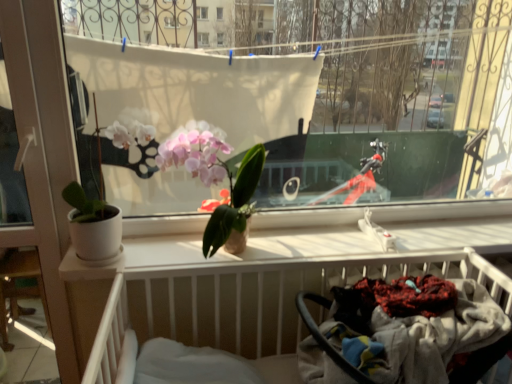
Question: Considering the relative sizes of white plastic screen door at left and pink matte orchid at center in the image provided, is white plastic screen door at left wider than pink matte orchid at center?

Choices:
 (A) no
 (B) yes

Answer: (A)

Question: Is white plastic screen door at left oriented towards pink matte orchid at center?

Choices:
 (A) yes
 (B) no

Answer: (B)

Question: Does white plastic screen door at left have a lesser width compared to pink matte orchid at center?

Choices:
 (A) no
 (B) yes

Answer: (B)

Question: Is white plastic screen door at left at the left side of pink matte orchid at center?

Choices:
 (A) yes
 (B) no

Answer: (A)

Question: From the image's perspective, is white plastic screen door at left below pink matte orchid at center?

Choices:
 (A) yes
 (B) no

Answer: (A)

Question: Is pink matte orchid at center wider or thinner than black rubber baby carriage at lower right?

Choices:
 (A) thin
 (B) wide

Answer: (A)

Question: From the image's perspective, is pink matte orchid at center above or below black rubber baby carriage at lower right?

Choices:
 (A) above
 (B) below

Answer: (A)

Question: In terms of size, does pink matte orchid at center appear bigger or smaller than black rubber baby carriage at lower right?

Choices:
 (A) small
 (B) big

Answer: (A)

Question: Is pink matte orchid at center taller or shorter than black rubber baby carriage at lower right?

Choices:
 (A) tall
 (B) short

Answer: (A)

Question: Relative to white plastic hospital bed at lower center, is pink matte orchid at center in front or behind?

Choices:
 (A) behind
 (B) front

Answer: (A)

Question: Choose the correct answer: Is pink matte orchid at center inside white plastic hospital bed at lower center or outside it?

Choices:
 (A) outside
 (B) inside

Answer: (A)

Question: From the image's perspective, relative to white plastic hospital bed at lower center, is pink matte orchid at center above or below?

Choices:
 (A) below
 (B) above

Answer: (B)

Question: From their relative heights in the image, would you say pink matte orchid at center is taller or shorter than white plastic hospital bed at lower center?

Choices:
 (A) tall
 (B) short

Answer: (B)

Question: In terms of size, does black rubber baby carriage at lower right appear bigger or smaller than pink matte orchid at center?

Choices:
 (A) big
 (B) small

Answer: (A)

Question: From the image's perspective, is black rubber baby carriage at lower right positioned above or below pink matte orchid at center?

Choices:
 (A) above
 (B) below

Answer: (B)